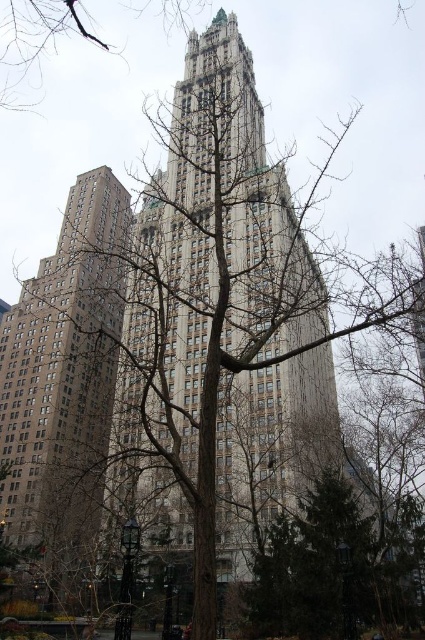
You are a bird flying towards the gray stone tower at center and the bare branches at upper center. Which object will you reach first?

The gray stone tower at center is larger than the bare branches at upper center, so you will reach the gray stone tower at center first because it is closer to you.

You are a drone operator planning to fly a drone between the gray stone tower at center and the beige stone building at left. The drone has a maximum flight distance of 20 meters. Can the drone safely fly between them without exceeding its range?

The gray stone tower at center and beige stone building at left are 18.55 meters apart from each other, so the drone can safely fly between them as the distance is within its 20 meters range.

Consider the image. You are standing in front of the historic skyscraper and notice the gray stone tower at center and the bare branches at upper center. Which object is closer to you?

The gray stone tower at center is closer to the viewer than the bare branches at upper center.